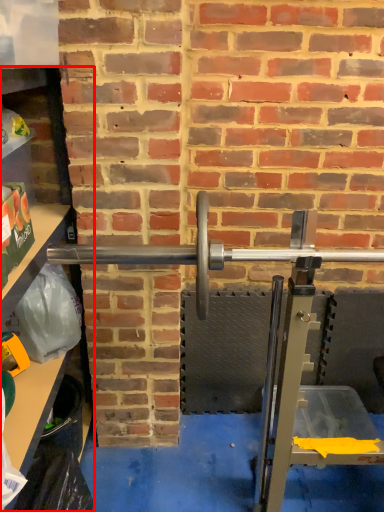
Question: From the image's perspective, where is shelf (annotated by the red box) located relative to barbell?

Choices:
 (A) below
 (B) above

Answer: (A)